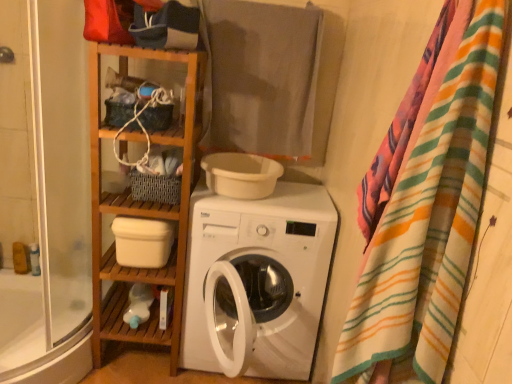
This screenshot has width=512, height=384. What do you see at coordinates (45, 190) in the screenshot?
I see `transparent glass shower door at left` at bounding box center [45, 190].

Measure the distance between white matte bowl at center and camera.

white matte bowl at center is 5.59 feet away from camera.

What do you see at coordinates (262, 274) in the screenshot? The height and width of the screenshot is (384, 512). I see `white matte washing machine at center` at bounding box center [262, 274].

Locate an element on the screen. This screenshot has width=512, height=384. wooden shelf at left, the first cabinet positioned from the bottom is located at coordinates (142, 207).

This screenshot has width=512, height=384. I want to click on white glossy bathtub at lower left, so click(35, 337).

Could you tell me if white glossy bathtub at lower left is turned towards striped cotton blanket at right?

No, white glossy bathtub at lower left is not aimed at striped cotton blanket at right.

Can you confirm if white glossy bathtub at lower left is smaller than striped cotton blanket at right?

Actually, white glossy bathtub at lower left might be larger than striped cotton blanket at right.

From a real-world perspective, which is physically above, white glossy bathtub at lower left or striped cotton blanket at right?

In real-world perspective, striped cotton blanket at right is above.

Which of these two, white glossy bathtub at lower left or striped cotton blanket at right, is thinner?

striped cotton blanket at right is thinner.

Which of these two, white matte bowl at center or gray cotton towel at upper center, is thinner?

gray cotton towel at upper center is thinner.

From a real-world perspective, which is physically below, white matte bowl at center or gray cotton towel at upper center?

From a 3D spatial view, white matte bowl at center is below.

Which of these two, white matte bowl at center or gray cotton towel at upper center, is smaller?

white matte bowl at center.

Is gray cotton towel at upper center inside white matte bowl at center?

Result: No, gray cotton towel at upper center is not inside white matte bowl at center.

How many degrees apart are the facing directions of wooden shelf at upper left, which is the 1th cabinet in top-to-bottom order, and white matte bowl at center?

There is a 0.496-degree angle between the facing directions of wooden shelf at upper left, which is the 1th cabinet in top-to-bottom order, and white matte bowl at center.

Does wooden shelf at upper left, the second cabinet from the bottom, have a greater width compared to white matte bowl at center?

No.

From the image's perspective, is wooden shelf at upper left, the second cabinet from the bottom, on white matte bowl at center?

Yes.

Locate an element on the screen. This screenshot has width=512, height=384. toilet bowl behind the wooden shelf at upper left, which is the 1th cabinet in top-to-bottom order is located at coordinates click(x=241, y=175).

How distant is white matte bowl at center from woven fabric basket at center, which ranks as the first shelf in top-to-bottom order?

25.35 centimeters.

The width and height of the screenshot is (512, 384). Identify the location of toilet bowl on the right of woven fabric basket at center, which ranks as the first shelf in top-to-bottom order. coord(241,175).

Which of these two, white matte bowl at center or woven fabric basket at center, which ranks as the first shelf in top-to-bottom order, is thinner?

woven fabric basket at center, which ranks as the first shelf in top-to-bottom order, is thinner.

Consider the image. Does white matte bowl at center come in front of woven fabric basket at center, the 2th shelf ordered from the bottom?

No.

Between striped cotton blanket at right and white matte bowl at center, which one appears on the left side from the viewer's perspective?

Positioned to the left is white matte bowl at center.

Which is behind, point (403, 216) or point (259, 194)?

The point (259, 194) is farther from the camera.

From a real-world perspective, relative to white matte bowl at center, is striped cotton blanket at right vertically above or below?

striped cotton blanket at right is above white matte bowl at center.

This screenshot has height=384, width=512. What are the coordinates of `shower door on the left of white matte washing machine at center` in the screenshot? It's located at (45, 190).

Does transparent glass shower door at left appear on the left side of white matte washing machine at center?

Indeed, transparent glass shower door at left is positioned on the left side of white matte washing machine at center.

Does transparent glass shower door at left contain white matte washing machine at center?

No, transparent glass shower door at left does not contain white matte washing machine at center.

Considering the relative sizes of transparent glass shower door at left and white matte washing machine at center in the image provided, is transparent glass shower door at left smaller than white matte washing machine at center?

Incorrect, transparent glass shower door at left is not smaller in size than white matte washing machine at center.

From the picture: Which of these two, white glossy bathtub at lower left or white matte plastic container at center-left, which ranks as the 2th shelf in top-to-bottom order, stands taller?

white matte plastic container at center-left, which ranks as the 2th shelf in top-to-bottom order.

Considering the points (42, 375) and (133, 280), which point is in front, point (42, 375) or point (133, 280)?

The point (42, 375) is more forward.

Is white glossy bathtub at lower left wider than white matte plastic container at center-left, which ranks as the 2th shelf in top-to-bottom order?

Yes.

Locate an element on the screen. This screenshot has width=512, height=384. blanket on the right of white glossy bathtub at lower left is located at coordinates (429, 221).

You are a GUI agent. You are given a task and a screenshot of the screen. Output one action in this format:
    pyautogui.click(x=<x>, y=<y>)
    Task: Click on the beach towel above the white matte bowl at center (from the image's perspective)
    Image resolution: width=512 pixels, height=384 pixels.
    Given the screenshot: What is the action you would take?
    pyautogui.click(x=260, y=77)

Estimate the real-world distances between objects in this image. Which object is closer to wooden shelf at left, marked as the 2th cabinet in a top-to-bottom arrangement, striped cotton blanket at right or white matte washing machine at center?

white matte washing machine at center is closer to wooden shelf at left, marked as the 2th cabinet in a top-to-bottom arrangement.

Consider the image. Looking at the image, which one is located further to wooden shelf at upper left, which is the 1th cabinet in top-to-bottom order, gray cotton towel at upper center or woven fabric basket at center, the 2th shelf ordered from the bottom?

The object further to wooden shelf at upper left, which is the 1th cabinet in top-to-bottom order, is gray cotton towel at upper center.

Which object lies further to the anchor point gray cotton towel at upper center, wooden shelf at left, marked as the 2th cabinet in a top-to-bottom arrangement, or white matte bowl at center?

wooden shelf at left, marked as the 2th cabinet in a top-to-bottom arrangement, is positioned further to the anchor gray cotton towel at upper center.

Which object lies further to the anchor point transparent glass shower door at left, white matte plastic container at center-left, which ranks as the 2th shelf in top-to-bottom order, or gray cotton towel at upper center?

Based on the image, gray cotton towel at upper center appears to be further to transparent glass shower door at left.

Based on their spatial positions, is gray cotton towel at upper center or white matte washing machine at center closer to wooden shelf at left, marked as the 2th cabinet in a top-to-bottom arrangement?

white matte washing machine at center lies closer to wooden shelf at left, marked as the 2th cabinet in a top-to-bottom arrangement, than the other object.

Based on their spatial positions, is transparent glass shower door at left or white matte plastic container at center-left, which ranks as the 2th shelf in top-to-bottom order, closer to white glossy bathtub at lower left?

transparent glass shower door at left is positioned closer to the anchor white glossy bathtub at lower left.

Which object lies further to the anchor point wooden shelf at upper left, which is the 1th cabinet in top-to-bottom order, wooden shelf at left, marked as the 2th cabinet in a top-to-bottom arrangement, or transparent glass shower door at left?

Among the two, transparent glass shower door at left is located further to wooden shelf at upper left, which is the 1th cabinet in top-to-bottom order.

When comparing their distances from white matte plastic container at center-left, the 1th shelf ordered from the bottom, does white matte washing machine at center or transparent glass shower door at left seem further?

Based on the image, transparent glass shower door at left appears to be further to white matte plastic container at center-left, the 1th shelf ordered from the bottom.

Where is `cabinet between gray cotton towel at upper center and wooden shelf at left, the first cabinet positioned from the bottom, in the up-down direction`? This screenshot has height=384, width=512. cabinet between gray cotton towel at upper center and wooden shelf at left, the first cabinet positioned from the bottom, in the up-down direction is located at coordinates (127, 73).

Identify the location of shower door between wooden shelf at upper left, which is the 1th cabinet in top-to-bottom order, and white glossy bathtub at lower left, in the vertical direction. This screenshot has width=512, height=384. (45, 190).

Find the location of a particular element. shelf between transparent glass shower door at left and white matte plastic container at center-left, which ranks as the 2th shelf in top-to-bottom order, along the z-axis is located at coordinates (148, 203).

Image resolution: width=512 pixels, height=384 pixels. Find the location of `shelf between gray cotton towel at upper center and wooden shelf at left, the first cabinet positioned from the bottom, from top to bottom`. shelf between gray cotton towel at upper center and wooden shelf at left, the first cabinet positioned from the bottom, from top to bottom is located at coordinates [148, 203].